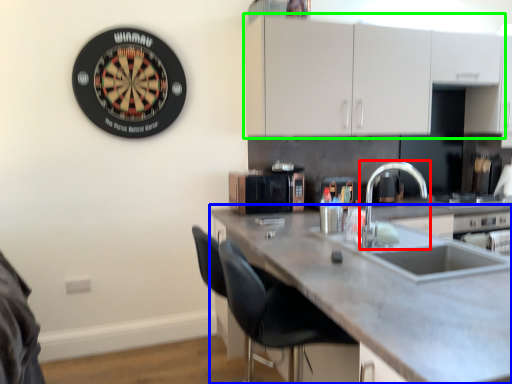
Question: Which is nearer to the tap (highlighted by a red box)? countertop (highlighted by a blue box) or cabinetry (highlighted by a green box).

Choices:
 (A) countertop
 (B) cabinetry

Answer: (B)